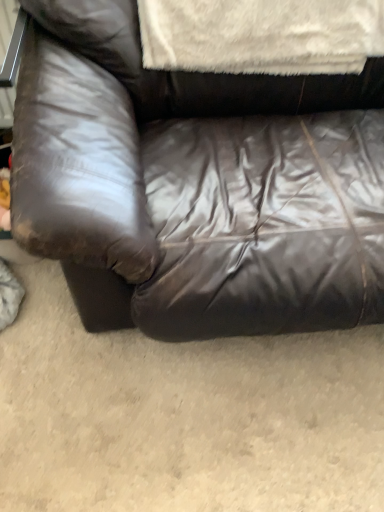
Question: From the image's perspective, is white fluffy blanket at upper center below shiny brown leather couch at center?

Choices:
 (A) yes
 (B) no

Answer: (B)

Question: From the image's perspective, is white fluffy blanket at upper center located above shiny brown leather couch at center?

Choices:
 (A) no
 (B) yes

Answer: (B)

Question: Does white fluffy blanket at upper center have a smaller size compared to shiny brown leather couch at center?

Choices:
 (A) no
 (B) yes

Answer: (B)

Question: Is white fluffy blanket at upper center not within shiny brown leather couch at center?

Choices:
 (A) yes
 (B) no

Answer: (B)

Question: Are white fluffy blanket at upper center and shiny brown leather couch at center beside each other?

Choices:
 (A) yes
 (B) no

Answer: (B)

Question: Is white fluffy blanket at upper center to the right of shiny brown leather couch at center from the viewer's perspective?

Choices:
 (A) no
 (B) yes

Answer: (A)

Question: Is shiny brown leather couch at center thinner than white fluffy blanket at upper center?

Choices:
 (A) no
 (B) yes

Answer: (A)

Question: Is shiny brown leather couch at center placed right next to white fluffy blanket at upper center?

Choices:
 (A) no
 (B) yes

Answer: (A)

Question: Is shiny brown leather couch at center turned away from white fluffy blanket at upper center?

Choices:
 (A) yes
 (B) no

Answer: (A)

Question: Is shiny brown leather couch at center bigger than white fluffy blanket at upper center?

Choices:
 (A) yes
 (B) no

Answer: (A)

Question: Considering the relative sizes of shiny brown leather couch at center and white fluffy blanket at upper center in the image provided, is shiny brown leather couch at center smaller than white fluffy blanket at upper center?

Choices:
 (A) yes
 (B) no

Answer: (B)

Question: From a real-world perspective, does shiny brown leather couch at center sit lower than white fluffy blanket at upper center?

Choices:
 (A) yes
 (B) no

Answer: (A)

Question: Is white fluffy blanket at upper center bigger or smaller than shiny brown leather couch at center?

Choices:
 (A) small
 (B) big

Answer: (A)